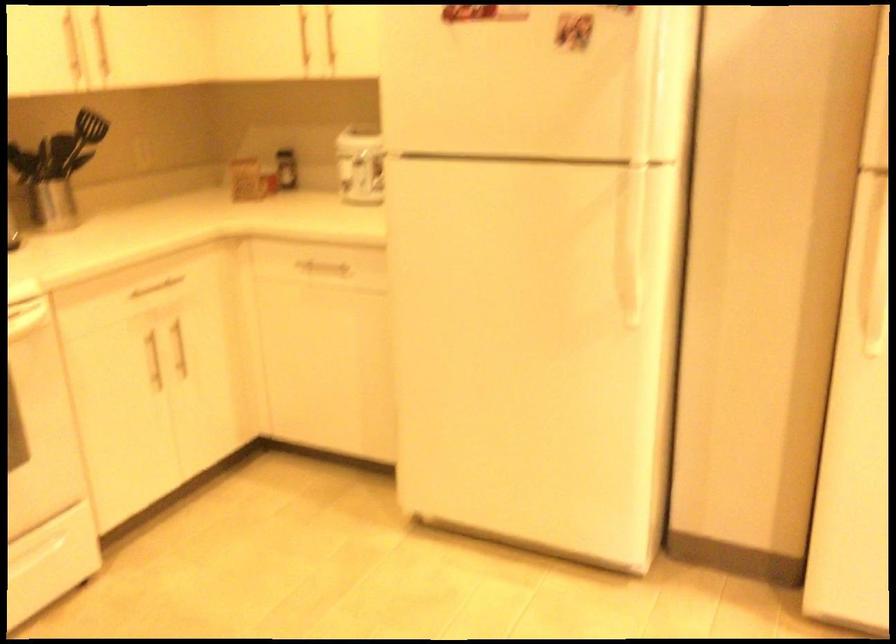
You are a GUI agent. You are given a task and a screenshot of the screen. Output one action in this format:
    pyautogui.click(x=<x>, y=<y>)
    Task: Click on the white refrigerator handle
    This screenshot has width=896, height=644.
    Given the screenshot: What is the action you would take?
    pyautogui.click(x=642, y=104)